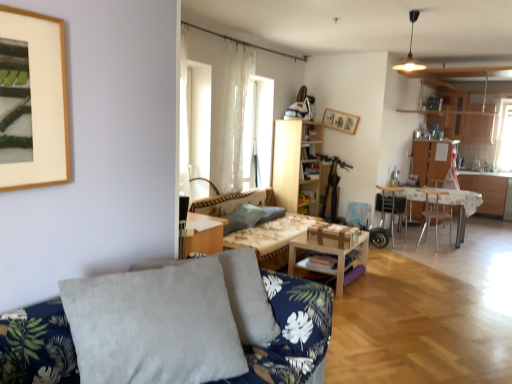
Measure the distance between point (294, 221) and camera.

17.31 feet.

Identify the location of wooden picture frame at upper center. This screenshot has height=384, width=512. (340, 121).

In order to face metallic silver chair at center, the first chair positioned from the right, should I rotate leftwards or rightwards?

You should rotate right by 22.804 degrees.

The image size is (512, 384). In order to click on sheer white curtain at center in this screenshot , I will do `click(234, 115)`.

What do you see at coordinates (234, 115) in the screenshot? Image resolution: width=512 pixels, height=384 pixels. I see `sheer white curtain at center` at bounding box center [234, 115].

This screenshot has height=384, width=512. Find the location of `wooden bookshelf at center`. wooden bookshelf at center is located at coordinates (309, 170).

Can you confirm if metallic silver armchair at right is smaller than gray velvety pillow at center, the second pillow positioned from the back?

Correct, metallic silver armchair at right occupies less space than gray velvety pillow at center, the second pillow positioned from the back.

From a real-world perspective, is metallic silver armchair at right positioned above or below gray velvety pillow at center, the first pillow viewed from the front?

metallic silver armchair at right is below gray velvety pillow at center, the first pillow viewed from the front.

Are metallic silver armchair at right and gray velvety pillow at center, the second pillow positioned from the back, making contact?

No, metallic silver armchair at right is not touching gray velvety pillow at center, the second pillow positioned from the back.

Considering the relative sizes of metallic silver armchair at right and gray velvety pillow at center, the second pillow positioned from the back, in the image provided, is metallic silver armchair at right thinner than gray velvety pillow at center, the second pillow positioned from the back,?

Incorrect, the width of metallic silver armchair at right is not less than that of gray velvety pillow at center, the second pillow positioned from the back.

Between gray velvety pillow at center, the second pillow positioned from the back, and gray fabric pillow at center, acting as the 1th pillow starting from the back, which one appears on the right side from the viewer's perspective?

gray fabric pillow at center, acting as the 1th pillow starting from the back, is more to the right.

At what (x,y) coordinates should I click in order to perform the action: click on pillow above the gray fabric pillow at center, acting as the 1th pillow starting from the back (from a real-world perspective). Please return your answer as a coordinate pair (x, y). The width and height of the screenshot is (512, 384). Looking at the image, I should click on (154, 325).

Considering the sizes of objects gray velvety pillow at center, the first pillow viewed from the front, and gray fabric pillow at center, the 2th pillow viewed from the front, in the image provided, who is smaller, gray velvety pillow at center, the first pillow viewed from the front, or gray fabric pillow at center, the 2th pillow viewed from the front,?

With smaller size is gray fabric pillow at center, the 2th pillow viewed from the front.

From a real-world perspective, relative to gray fabric pillow at center, acting as the 1th pillow starting from the back, is gray velvety pillow at center, the first pillow viewed from the front, vertically above or below?

From a real-world perspective, gray velvety pillow at center, the first pillow viewed from the front, is physically above gray fabric pillow at center, acting as the 1th pillow starting from the back.

From the image's perspective, which is below, metallic silver chair at right, which is counted as the second chair, starting from the right, or wooden picture frame at upper center?

From the image's view, metallic silver chair at right, which is counted as the second chair, starting from the right, is below.

Can you confirm if metallic silver chair at right, the 1th chair when ordered from left to right, is taller than wooden picture frame at upper center?

Yes, metallic silver chair at right, the 1th chair when ordered from left to right, is taller than wooden picture frame at upper center.

Can you confirm if metallic silver chair at right, which is counted as the second chair, starting from the right, is smaller than wooden picture frame at upper center?

No, metallic silver chair at right, which is counted as the second chair, starting from the right, is not smaller than wooden picture frame at upper center.

Which point is more distant from viewer, [400,197] or [335,122]?

The point [400,197] is more distant.

Is light wood bookshelf at center to the left of metallic silver chair at right, which is counted as the second chair, starting from the right, from the viewer's perspective?

Yes.

From their relative heights in the image, would you say light wood bookshelf at center is taller or shorter than metallic silver chair at right, which is counted as the second chair, starting from the right?

light wood bookshelf at center is taller than metallic silver chair at right, which is counted as the second chair, starting from the right.

Is matte gold light fixture at upper center wider or thinner than sheer white curtain at center?

In the image, matte gold light fixture at upper center appears to be wider than sheer white curtain at center.

What's the angular difference between matte gold light fixture at upper center and sheer white curtain at center's facing directions?

The facing directions of matte gold light fixture at upper center and sheer white curtain at center are 89.8 degrees apart.

From the image's perspective, who appears lower, matte gold light fixture at upper center or sheer white curtain at center?

sheer white curtain at center, from the image's perspective.

In terms of size, does matte gold light fixture at upper center appear bigger or smaller than sheer white curtain at center?

Considering their sizes, matte gold light fixture at upper center takes up less space than sheer white curtain at center.

From the image's perspective, is wooden table at center, the second table from the back, on top of metallic silver chair at center, the first chair positioned from the right?

No, from the image's perspective, wooden table at center, the second table from the back, is not above metallic silver chair at center, the first chair positioned from the right.

Based on the photo, which object is closer to the camera, wooden table at center, which is the 1th table in front-to-back order, or metallic silver chair at center, the first chair positioned from the right?

wooden table at center, which is the 1th table in front-to-back order, is more forward.

Is wooden table at center, arranged as the 2th table when viewed from the right, shorter than metallic silver chair at center, the first chair positioned from the right?

Correct, wooden table at center, arranged as the 2th table when viewed from the right, is not as tall as metallic silver chair at center, the first chair positioned from the right.

Are wooden table at center, which is the 1th table in front-to-back order, and metallic silver chair at center, the first chair positioned from the right, beside each other?

wooden table at center, which is the 1th table in front-to-back order, and metallic silver chair at center, the first chair positioned from the right, are clearly separated.

Based on the photo, considering the sizes of objects gray fabric pillow at center, the 2th pillow viewed from the front, and sheer white curtain at center in the image provided, who is wider, gray fabric pillow at center, the 2th pillow viewed from the front, or sheer white curtain at center?

Wider between the two is gray fabric pillow at center, the 2th pillow viewed from the front.

Is gray fabric pillow at center, the 2th pillow viewed from the front, taller than sheer white curtain at center?

No.

In order to click on curtain in front of the gray fabric pillow at center, the 2th pillow viewed from the front in this screenshot , I will do `click(234, 115)`.

Is gray fabric pillow at center, the 2th pillow viewed from the front, completely or partially outside of sheer white curtain at center?

That's correct, gray fabric pillow at center, the 2th pillow viewed from the front, is outside of sheer white curtain at center.

The width and height of the screenshot is (512, 384). Find the location of `armchair directly beneath the gray velvety pillow at center, the second pillow positioned from the back (from a real-world perspective)`. armchair directly beneath the gray velvety pillow at center, the second pillow positioned from the back (from a real-world perspective) is located at coordinates (436, 208).

I want to click on pillow below the gray fabric pillow at center, acting as the 1th pillow starting from the back (from the image's perspective), so click(x=154, y=325).

Looking at the image, which one is located closer to white glossy table at right, the second table positioned from the left, gray velvety pillow at center, the second pillow positioned from the back, or light wood bookshelf at center?

light wood bookshelf at center is closer to white glossy table at right, the second table positioned from the left.

When comparing their distances from wooden table at center, arranged as the 2th table when viewed from the right, does metallic silver chair at right, which is counted as the second chair, starting from the right, or sheer white curtain at center seem further?

metallic silver chair at right, which is counted as the second chair, starting from the right.

Looking at the image, which one is located further to light wood bookshelf at center, metallic silver chair at center, the first chair positioned from the right, or wooden bookshelf at center?

metallic silver chair at center, the first chair positioned from the right, is positioned further to the anchor light wood bookshelf at center.

Consider the image. Which object lies further to the anchor point matte gold light fixture at upper center, sheer white curtain at center or gray velvety pillow at center, the second pillow positioned from the back?

Based on the image, gray velvety pillow at center, the second pillow positioned from the back, appears to be further to matte gold light fixture at upper center.

Estimate the real-world distances between objects in this image. Which object is further from wooden bookshelf at center, translucent fabric at center or woodenobject at center?

woodenobject at center is positioned further to the anchor wooden bookshelf at center.

Considering their positions, is metallic silver armchair at right positioned further to sheer white curtain at center than translucent fabric at center?

metallic silver armchair at right is positioned further to the anchor sheer white curtain at center.

From the image, which object appears to be farther from matte gold light fixture at upper center, metallic silver chair at right, which is counted as the second chair, starting from the right, or light wood bookshelf at center?

light wood bookshelf at center lies further to matte gold light fixture at upper center than the other object.

Estimate the real-world distances between objects in this image. Which object is further from wooden picture frame at upper center, matte gold light fixture at upper center or sheer white curtain at center?

sheer white curtain at center.

Where is `light fixture located between gray velvety pillow at center, the second pillow positioned from the back, and wooden table at center, which ranks as the first table in left-to-right order, in the depth direction`? light fixture located between gray velvety pillow at center, the second pillow positioned from the back, and wooden table at center, which ranks as the first table in left-to-right order, in the depth direction is located at coordinates point(410,50).

I want to click on cabinetry between translucent fabric at center and white glossy table at right, the second table viewed from the front, from left to right, so 297,164.

You are a GUI agent. You are given a task and a screenshot of the screen. Output one action in this format:
    pyautogui.click(x=<x>, y=<y>)
    Task: Click on the cabinetry situated between gray fabric pillow at center, the 2th pillow viewed from the front, and metallic silver chair at center, the first chair positioned from the right, from left to right
    This screenshot has width=512, height=384.
    Given the screenshot: What is the action you would take?
    pyautogui.click(x=297, y=164)

Where is `cabinetry between translucent fabric at center and metallic silver chair at center, positioned as the 2th chair in left-to-right order`? Image resolution: width=512 pixels, height=384 pixels. cabinetry between translucent fabric at center and metallic silver chair at center, positioned as the 2th chair in left-to-right order is located at coordinates (297, 164).